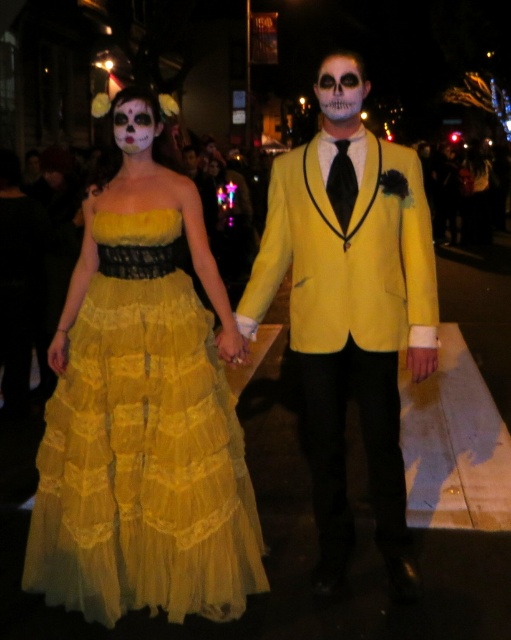
Looking at this image, can you confirm if matte yellow dress at center is wider than matte white face at upper left?

Indeed, matte yellow dress at center has a greater width compared to matte white face at upper left.

Who is taller, matte yellow dress at center or matte white face at upper left?

With more height is matte yellow dress at center.

The width and height of the screenshot is (511, 640). I want to click on matte yellow dress at center, so click(213, 378).

Identify the location of matte yellow dress at center. tap(213, 378).

Between matte yellow suit at center and white painted skull at center, which one appears on the left side from the viewer's perspective?

From the viewer's perspective, matte yellow suit at center appears more on the left side.

Is the position of matte yellow suit at center less distant than that of white painted skull at center?

Yes, matte yellow suit at center is closer to the viewer.

Where is `matte yellow suit at center`? This screenshot has height=640, width=511. matte yellow suit at center is located at coordinates (351, 321).

How distant is yellow tulle dress at center from matte white face at upper left?

They are 1.40 meters apart.

You are a GUI agent. You are given a task and a screenshot of the screen. Output one action in this format:
    pyautogui.click(x=<x>, y=<y>)
    Task: Click on the yellow tulle dress at center
    The image size is (511, 640).
    Given the screenshot: What is the action you would take?
    pyautogui.click(x=143, y=448)

Find the location of a particular element. Image resolution: width=511 pixels, height=640 pixels. yellow tulle dress at center is located at coordinates (143, 448).